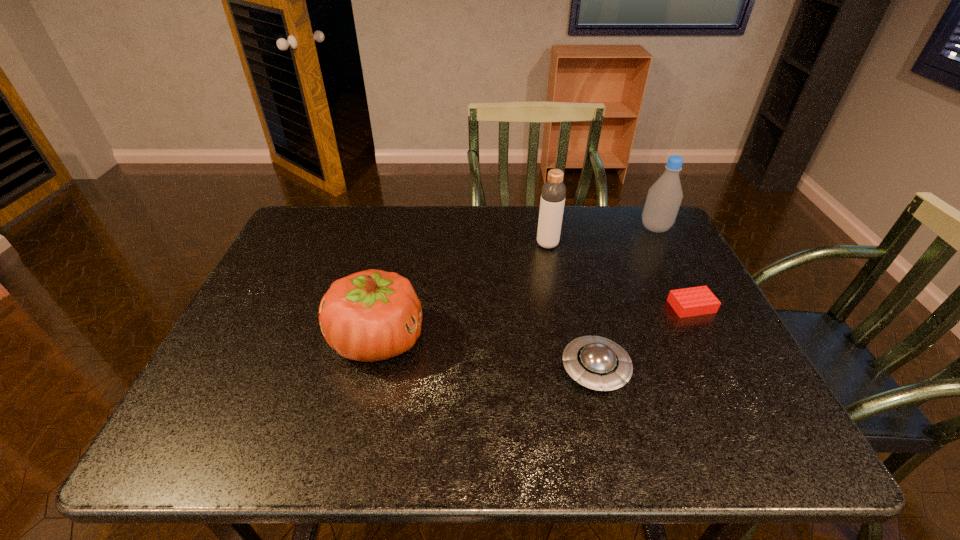
Locate an element on the screen. the right bottle is located at coordinates [664, 197].

Image resolution: width=960 pixels, height=540 pixels. I want to click on the farthest object, so click(x=664, y=197).

This screenshot has width=960, height=540. Find the location of `the left bottle`. the left bottle is located at coordinates (553, 193).

Where is `the nearer bottle`? the nearer bottle is located at coordinates (553, 193).

Where is `the leftmost object`? The height and width of the screenshot is (540, 960). the leftmost object is located at coordinates (372, 315).

At what (x,y) coordinates should I click in order to perform the action: click on pumpkin. Please return your answer as a coordinate pair (x, y). The height and width of the screenshot is (540, 960). Looking at the image, I should click on (372, 315).

Where is `saucer`? This screenshot has height=540, width=960. saucer is located at coordinates (597, 363).

The height and width of the screenshot is (540, 960). In order to click on the shortest object in this screenshot , I will do `click(694, 301)`.

Locate an element on the screen. This screenshot has width=960, height=540. free space located 0.370m on the front of the farthest object is located at coordinates (708, 327).

At what (x,y) coordinates should I click in order to perform the action: click on free region located 0.180m on the right of the left bottle. Please return your answer as a coordinate pair (x, y). The image size is (960, 540). Looking at the image, I should click on (619, 244).